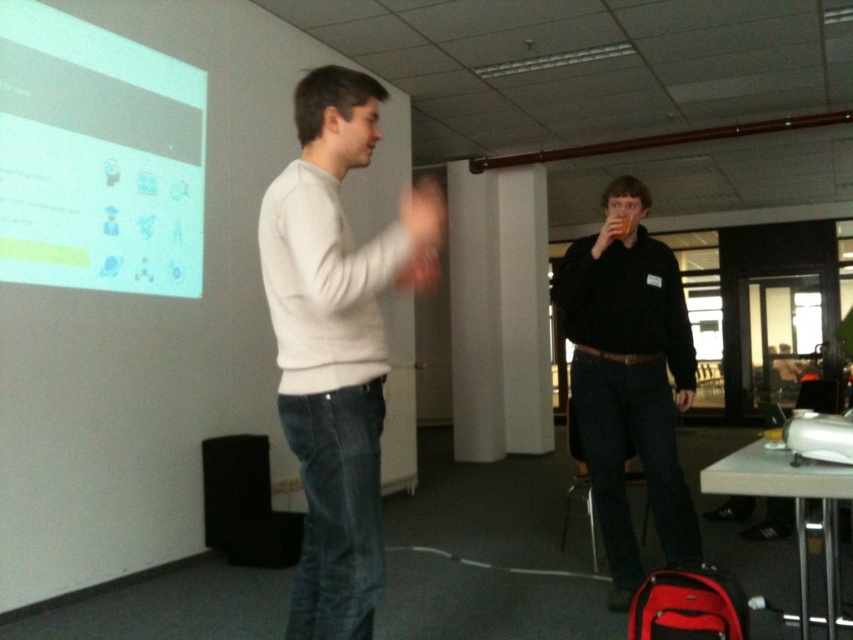
You are organizing a photo shoot and need to ensure that the two central figures in the image are framed properly. Given that the light gray sweater at center and the black matte shirt at center are both in the center, which one should you focus on first to ensure proper framing?

The light gray sweater at center is smaller than the black matte shirt at center, so you should focus on framing the black matte shirt at center first since it occupies more space and might require more attention for proper composition.

From the picture: You are standing in the conference room and want to place a small plant on the table at point (x=312, y=513). The plant requires 5 feet of space from the nearest wall. Can you place it there?

The distance of point (x=312, y=513) from camera is 6.26 feet. Since the plant requires 5 feet of space from the nearest wall, it can be placed there as the distance is sufficient.